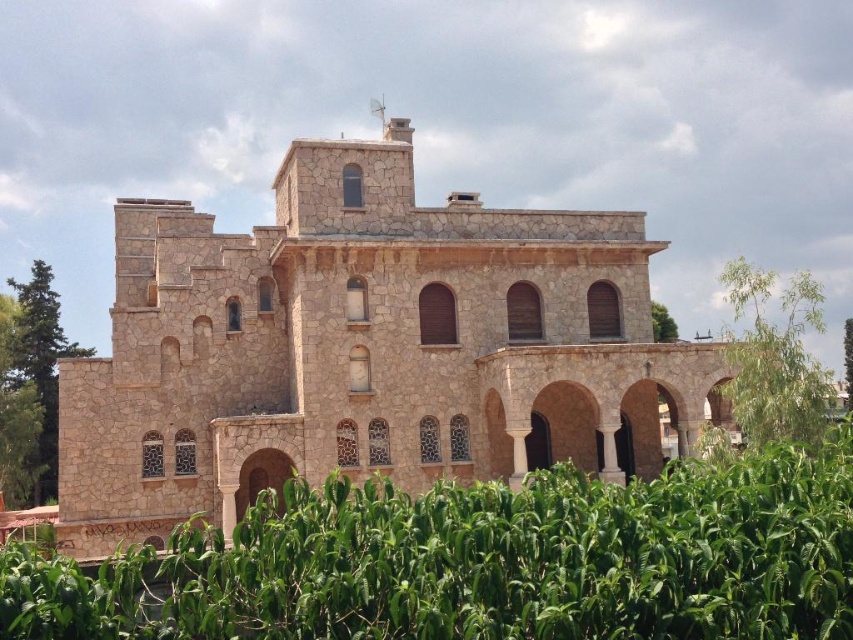
This screenshot has width=853, height=640. What do you see at coordinates (485, 561) in the screenshot?
I see `green leafy corn field at lower center` at bounding box center [485, 561].

Identify the location of green leafy corn field at lower center. (485, 561).

Does point (606, 557) come closer to viewer compared to point (56, 292)?

That is True.

I want to click on green leafy corn field at lower center, so click(x=485, y=561).

Where is `green leafy tree at right`? green leafy tree at right is located at coordinates (775, 356).

Can you confirm if green leafy tree at right is positioned to the right of green leafy tree at left?

Indeed, green leafy tree at right is positioned on the right side of green leafy tree at left.

Between point (782, 436) and point (44, 372), which one is positioned behind?

Point (44, 372)

The image size is (853, 640). Identify the location of green leafy tree at right. (775, 356).

Does beige stone church at center have a greater height compared to green leafy tree at right?

Yes.

Measure the distance from beige stone church at center to green leafy tree at right.

80.95 feet

Consider the image. Who is more distant from viewer, (268, 454) or (752, 413)?

Positioned behind is point (268, 454).

Find the location of `beige stone church at center`. beige stone church at center is located at coordinates (364, 349).